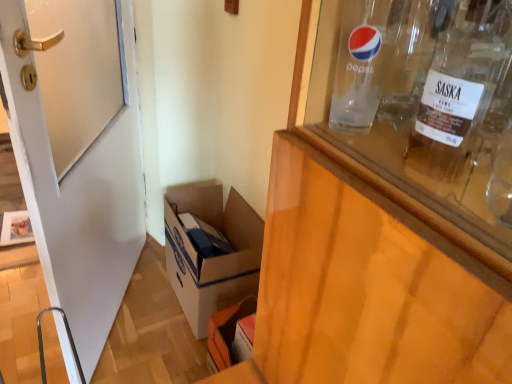
Question: Could transparent glass bottle at upper right be considered to be inside clear glass bottle at upper right?

Choices:
 (A) yes
 (B) no

Answer: (B)

Question: Is clear glass bottle at upper right not inside transparent glass bottle at upper right?

Choices:
 (A) no
 (B) yes

Answer: (B)

Question: From the image's perspective, does clear glass bottle at upper right appear higher than transparent glass bottle at upper right?

Choices:
 (A) no
 (B) yes

Answer: (B)

Question: Can you confirm if clear glass bottle at upper right is bigger than transparent glass bottle at upper right?

Choices:
 (A) yes
 (B) no

Answer: (A)

Question: From a real-world perspective, is clear glass bottle at upper right physically above transparent glass bottle at upper right?

Choices:
 (A) no
 (B) yes

Answer: (B)

Question: Is white glossy door at left inside or outside of transparent glass bottle at upper right?

Choices:
 (A) outside
 (B) inside

Answer: (A)

Question: Considering the positions of white glossy door at left and transparent glass bottle at upper right in the image, is white glossy door at left taller or shorter than transparent glass bottle at upper right?

Choices:
 (A) tall
 (B) short

Answer: (A)

Question: From a real-world perspective, is white glossy door at left positioned above or below transparent glass bottle at upper right?

Choices:
 (A) above
 (B) below

Answer: (B)

Question: Is white glossy door at left wider or thinner than transparent glass bottle at upper right?

Choices:
 (A) thin
 (B) wide

Answer: (B)

Question: Is clear glass bottle at upper right to the left or to the right of transparent glass bottle at upper right in the image?

Choices:
 (A) right
 (B) left

Answer: (B)

Question: Is clear glass bottle at upper right in front of or behind transparent glass bottle at upper right in the image?

Choices:
 (A) behind
 (B) front

Answer: (A)

Question: Considering the positions of clear glass bottle at upper right and transparent glass bottle at upper right in the image, is clear glass bottle at upper right bigger or smaller than transparent glass bottle at upper right?

Choices:
 (A) small
 (B) big

Answer: (B)

Question: Would you say clear glass bottle at upper right is inside or outside transparent glass bottle at upper right?

Choices:
 (A) inside
 (B) outside

Answer: (B)

Question: From the image's perspective, relative to white glossy door at left, is clear glass bottle at upper right above or below?

Choices:
 (A) above
 (B) below

Answer: (A)

Question: In terms of width, does clear glass bottle at upper right look wider or thinner when compared to white glossy door at left?

Choices:
 (A) wide
 (B) thin

Answer: (B)